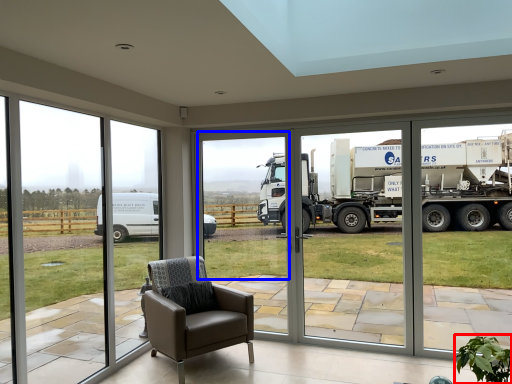
Question: Which object is closer to the camera taking this photo, plant (highlighted by a red box) or window screen (highlighted by a blue box)?

Choices:
 (A) plant
 (B) window screen

Answer: (A)